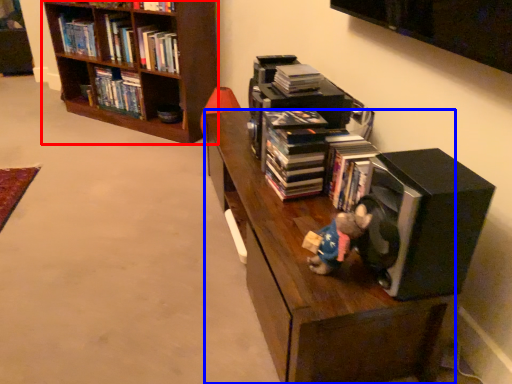
Question: Which object appears closest to the camera in this image, bookcase (highlighted by a red box) or shelf (highlighted by a blue box)?

Choices:
 (A) bookcase
 (B) shelf

Answer: (B)